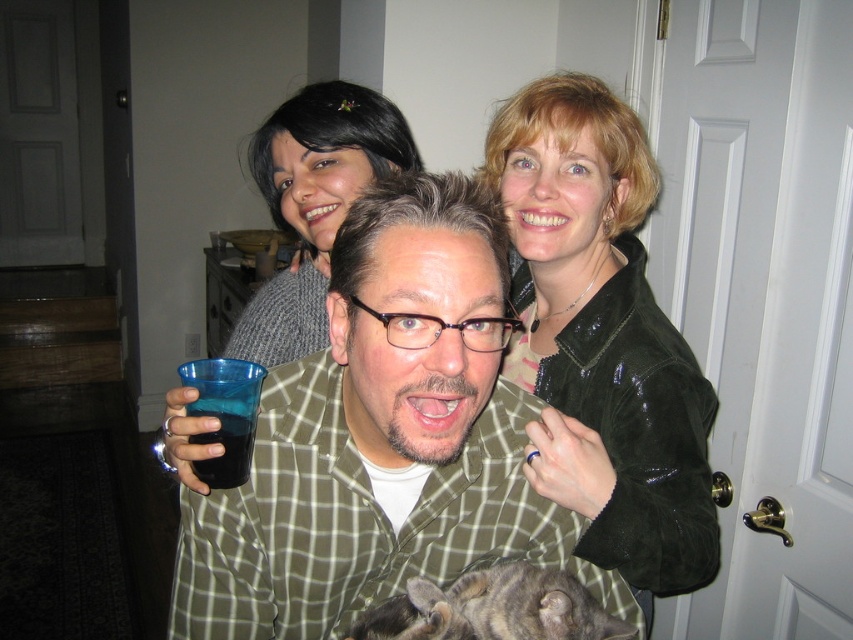
Question: Does shiny black jacket at upper right appear on the left side of gray sweater at upper center?

Choices:
 (A) yes
 (B) no

Answer: (B)

Question: Among these points, which one is farthest from the camera?

Choices:
 (A) (233, 397)
 (B) (309, 349)
 (C) (526, 628)
 (D) (456, 556)

Answer: (B)

Question: Which of the following is the closest to the observer?

Choices:
 (A) transparent plastic cup at center
 (B) shiny black jacket at upper right
 (C) tabby fur cat at lower center
 (D) green plaid shirt at center

Answer: (D)

Question: In this image, where is tabby fur cat at lower center located relative to transparent plastic cup at center?

Choices:
 (A) below
 (B) above

Answer: (A)

Question: Based on their relative distances, which object is farther from the transparent plastic cup at center?

Choices:
 (A) gray sweater at upper center
 (B) green plaid shirt at center
 (C) shiny black jacket at upper right

Answer: (A)

Question: Is green plaid shirt at center bigger than shiny black jacket at upper right?

Choices:
 (A) yes
 (B) no

Answer: (B)